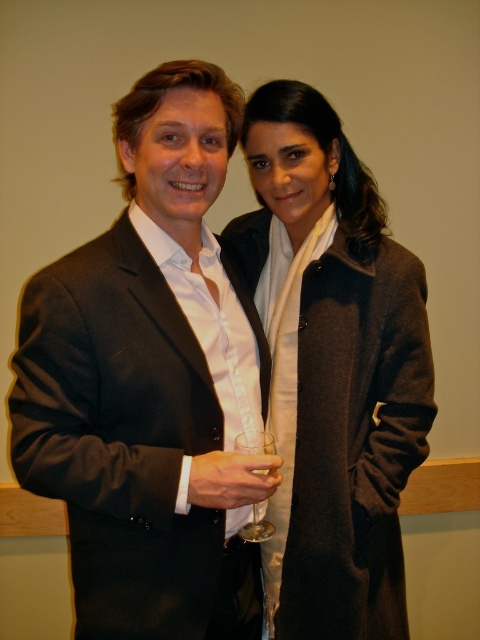
Question: Which object is farther from the camera taking this photo?

Choices:
 (A) matte gray coat at center
 (B) black matte suit at left

Answer: (A)

Question: Can you confirm if black matte suit at left is positioned above matte gray coat at center?

Choices:
 (A) no
 (B) yes

Answer: (A)

Question: Which object is farther from the camera taking this photo?

Choices:
 (A) matte gray coat at center
 (B) black matte suit at left

Answer: (A)

Question: Is matte gray coat at center to the left of clear glass wine glass at center from the viewer's perspective?

Choices:
 (A) no
 (B) yes

Answer: (A)

Question: Is matte gray coat at center above clear glass wine glass at center?

Choices:
 (A) no
 (B) yes

Answer: (B)

Question: Which object appears closest to the camera in this image?

Choices:
 (A) clear glass wine glass at center
 (B) matte gray coat at center
 (C) black matte suit at left

Answer: (C)